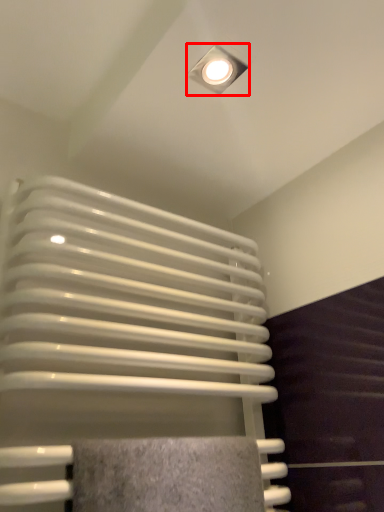
Question: Observing the image, what is the correct spatial positioning of lamp (annotated by the red box) in reference to radiator?

Choices:
 (A) left
 (B) right

Answer: (B)